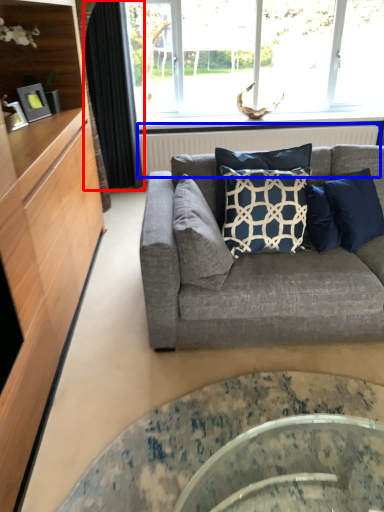
Question: Which of the following is the farthest to the observer, curtain (highlighted by a red box) or radiator (highlighted by a blue box)?

Choices:
 (A) curtain
 (B) radiator

Answer: (B)